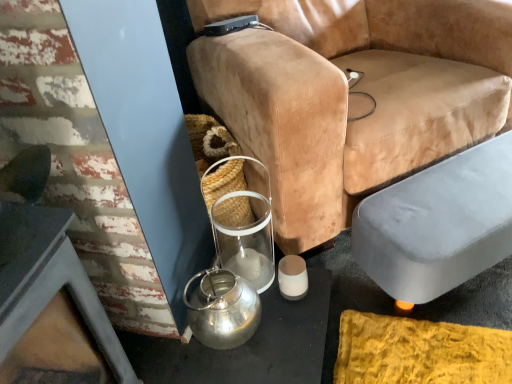
Question: Is the depth of gray fabric ottoman at lower right less than that of matte white candle at lower center?

Choices:
 (A) no
 (B) yes

Answer: (B)

Question: Does gray fabric ottoman at lower right have a larger size compared to matte white candle at lower center?

Choices:
 (A) yes
 (B) no

Answer: (A)

Question: Can you confirm if gray fabric ottoman at lower right is smaller than matte white candle at lower center?

Choices:
 (A) yes
 (B) no

Answer: (B)

Question: From the image's perspective, is gray fabric ottoman at lower right on matte white candle at lower center?

Choices:
 (A) yes
 (B) no

Answer: (A)

Question: Is gray fabric ottoman at lower right at the left side of matte white candle at lower center?

Choices:
 (A) yes
 (B) no

Answer: (B)

Question: From the image's perspective, relative to gray fabric ottoman at lower right, is shiny metallic kettle at lower left above or below?

Choices:
 (A) below
 (B) above

Answer: (A)

Question: Is shiny metallic kettle at lower left inside the boundaries of gray fabric ottoman at lower right, or outside?

Choices:
 (A) outside
 (B) inside

Answer: (A)

Question: From their relative heights in the image, would you say shiny metallic kettle at lower left is taller or shorter than gray fabric ottoman at lower right?

Choices:
 (A) tall
 (B) short

Answer: (B)

Question: Is shiny metallic kettle at lower left to the left or to the right of gray fabric ottoman at lower right in the image?

Choices:
 (A) left
 (B) right

Answer: (A)

Question: Considering their positions, is velvet tan chair at center located in front of or behind gray fabric ottoman at lower right?

Choices:
 (A) behind
 (B) front

Answer: (B)

Question: Is velvet tan chair at center wider or thinner than gray fabric ottoman at lower right?

Choices:
 (A) wide
 (B) thin

Answer: (A)

Question: Considering the positions of point (392, 173) and point (428, 203), is point (392, 173) closer or farther from the camera than point (428, 203)?

Choices:
 (A) closer
 (B) farther

Answer: (B)

Question: Considering the positions of velvet tan chair at center and gray fabric ottoman at lower right in the image, is velvet tan chair at center taller or shorter than gray fabric ottoman at lower right?

Choices:
 (A) tall
 (B) short

Answer: (A)

Question: Considering the positions of gray fabric ottoman at lower right and shiny metallic kettle at lower left in the image, is gray fabric ottoman at lower right taller or shorter than shiny metallic kettle at lower left?

Choices:
 (A) short
 (B) tall

Answer: (B)

Question: Is gray fabric ottoman at lower right situated inside shiny metallic kettle at lower left or outside?

Choices:
 (A) outside
 (B) inside

Answer: (A)